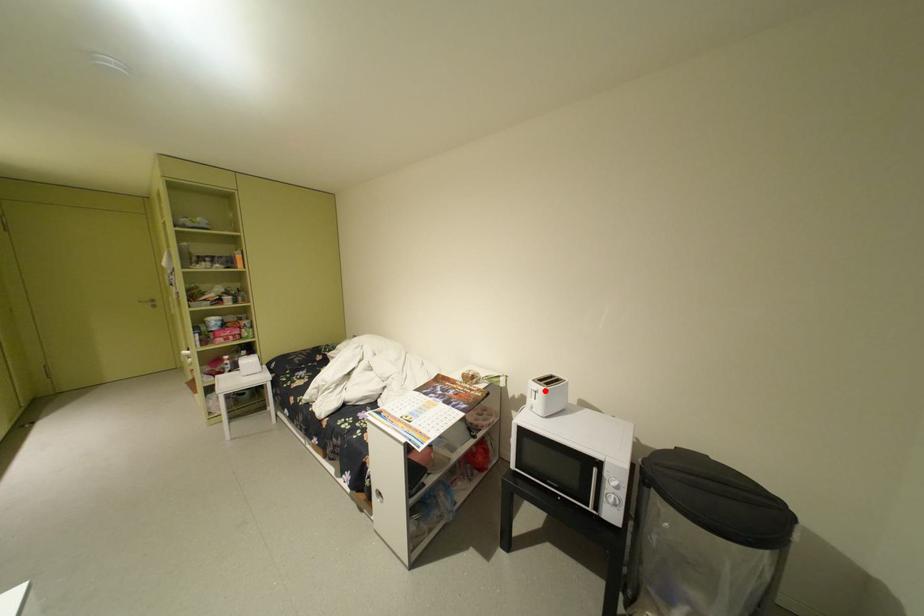
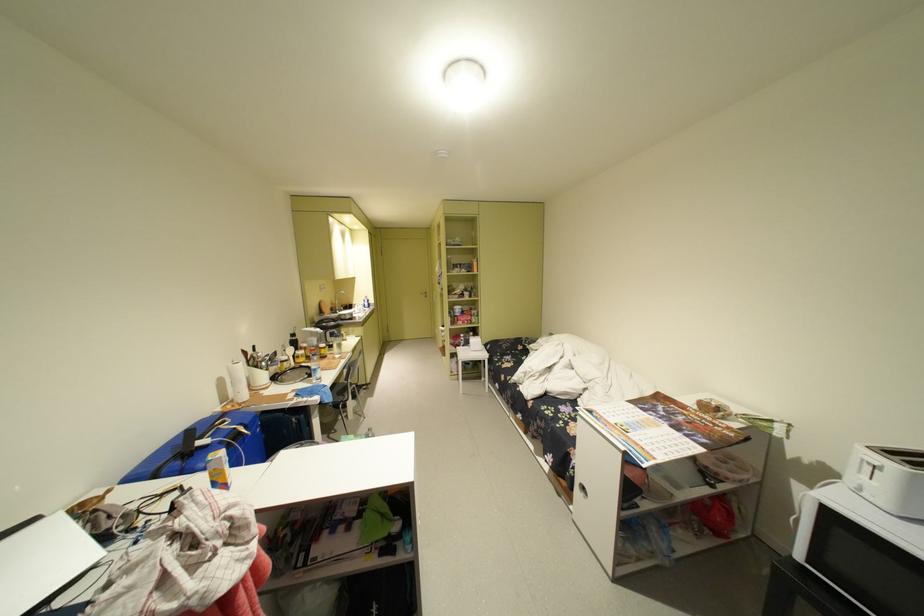
Question: I am providing you with two images of the same scene from different viewpoints. A red point is shown in image1. For the corresponding object point in image2, is it positioned nearer or farther from the camera?

Choices:
 (A) Nearer
 (B) Farther

Answer: (A)